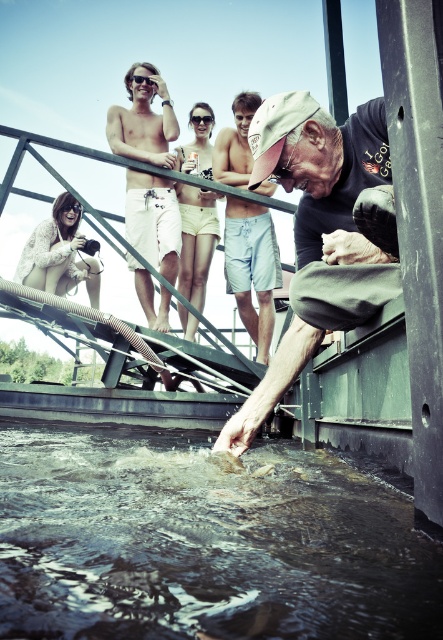
Who is more forward, (365, 564) or (208, 124)?

Point (365, 564) is more forward.

Is point (368, 630) closer to camera compared to point (208, 115)?

Yes, it is in front of point (208, 115).

The width and height of the screenshot is (443, 640). In order to click on dark water at lower center in this screenshot , I will do `click(202, 541)`.

Between point (205, 218) and point (69, 205), which one is positioned behind?

Point (205, 218)

What do you see at coordinates (195, 241) in the screenshot? The image size is (443, 640). I see `beige cotton shorts at center` at bounding box center [195, 241].

Who is more forward, (194, 236) or (73, 205)?

Point (73, 205) is more forward.

In order to click on beige cotton shorts at center in this screenshot , I will do `click(195, 241)`.

Is matte khaki shorts at center above white knitted sweater at lower left?

Actually, matte khaki shorts at center is below white knitted sweater at lower left.

Who is shorter, matte khaki shorts at center or white knitted sweater at lower left?

white knitted sweater at lower left

Is point (346, 317) farther from camera compared to point (77, 264)?

No, it is not.

Locate an element on the screen. This screenshot has width=443, height=640. matte khaki shorts at center is located at coordinates (314, 228).